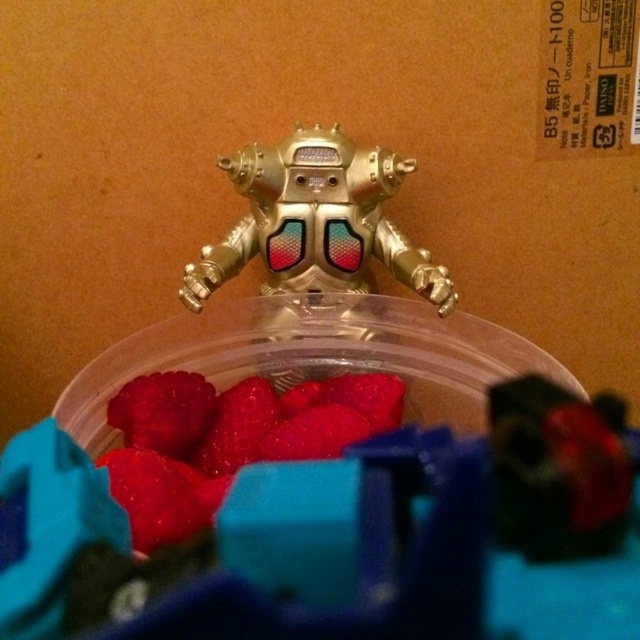
Question: Which object appears closest to the camera in this image?

Choices:
 (A) shiny red berries at center
 (B) gold metallic robot at center

Answer: (A)

Question: Does shiny red berries at center appear on the left side of gold metallic robot at center?

Choices:
 (A) yes
 (B) no

Answer: (A)

Question: Which point is closer to the camera?

Choices:
 (A) shiny red berries at center
 (B) gold metallic robot at center

Answer: (A)

Question: Is shiny red berries at center positioned before gold metallic robot at center?

Choices:
 (A) yes
 (B) no

Answer: (A)

Question: Which of the following is the closest to the observer?

Choices:
 (A) gold metallic robot at center
 (B) shiny red berries at center

Answer: (B)

Question: Is shiny red berries at center wider than gold metallic robot at center?

Choices:
 (A) no
 (B) yes

Answer: (A)